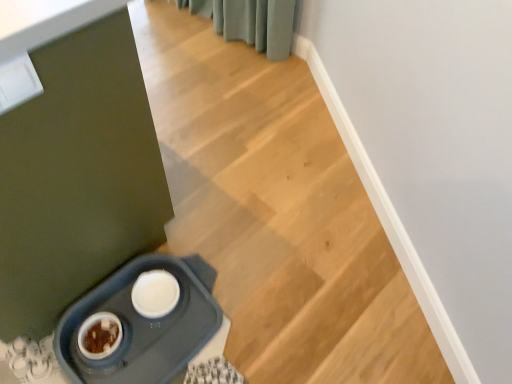
I want to click on free area behind matte plastic pet feeder at lower left, so click(x=216, y=215).